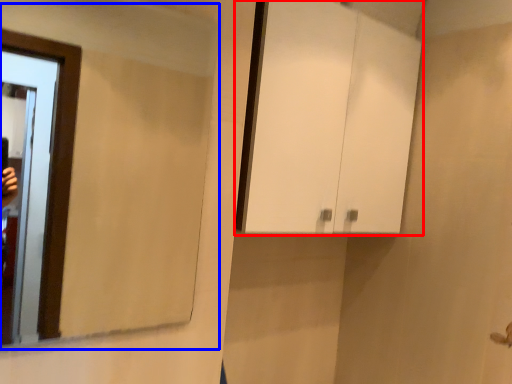
Question: Which point is further to the camera, cabinetry (highlighted by a red box) or mirror (highlighted by a blue box)?

Choices:
 (A) cabinetry
 (B) mirror

Answer: (A)